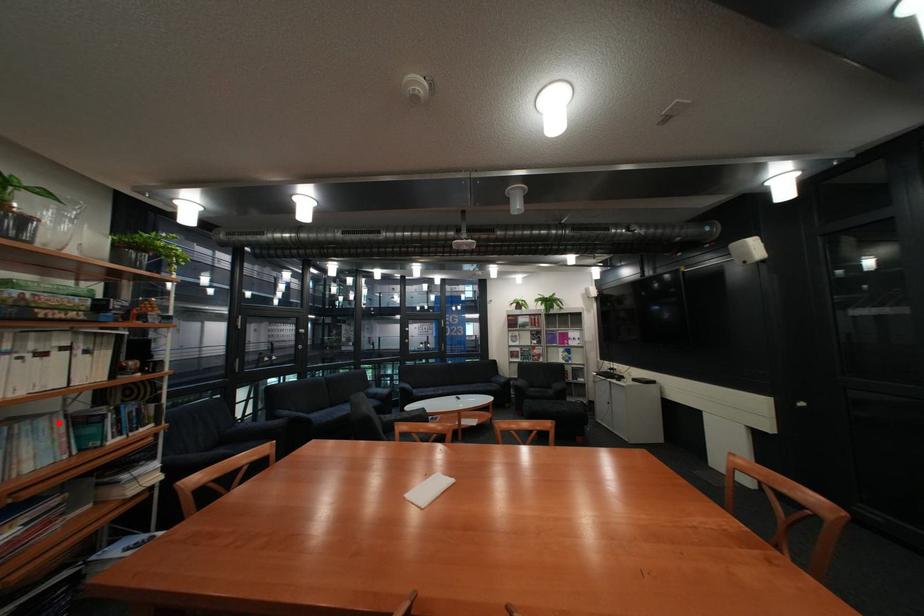
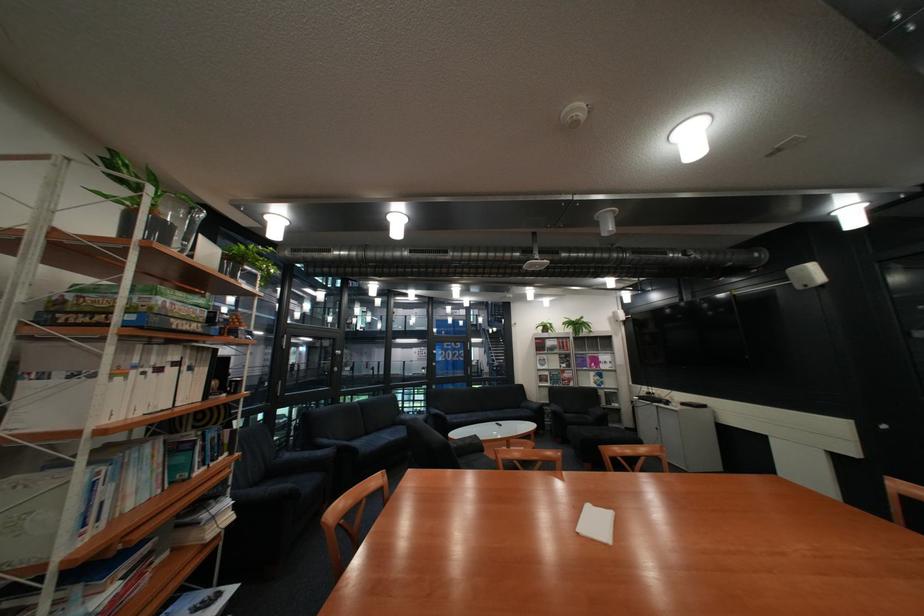
In the second image, find the point that corresponds to the highlighted location in the first image.

(163, 448)